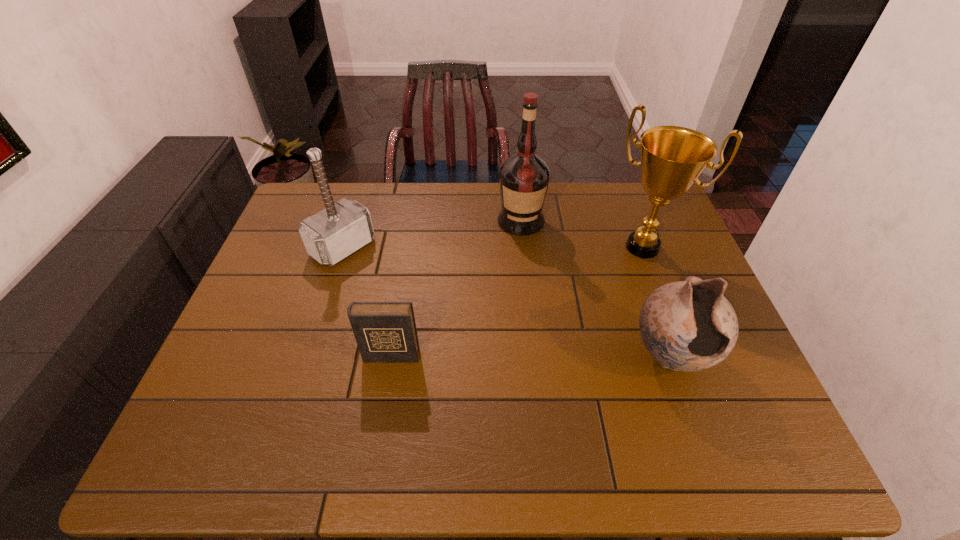
Locate an element on the screen. This screenshot has width=960, height=540. pottery that is at the right edge is located at coordinates (689, 325).

Identify the location of award that is at the right edge. The image size is (960, 540). (672, 158).

You are a GUI agent. You are given a task and a screenshot of the screen. Output one action in this format:
    pyautogui.click(x=<x>, y=<y>)
    Task: Click on the object present at the near right corner
    
    Given the screenshot: What is the action you would take?
    pyautogui.click(x=689, y=325)

Find the location of a particular element. free space at the far edge of the desktop is located at coordinates (587, 210).

Identify the location of vacant area at the near edge of the desktop. This screenshot has height=540, width=960. (390, 386).

This screenshot has width=960, height=540. Identify the location of vacant space at the left edge of the desktop. (295, 292).

You are a GUI agent. You are given a task and a screenshot of the screen. Output one action in this format:
    pyautogui.click(x=<x>, y=<y>)
    Task: Click on the vacant space at the right edge
    
    Given the screenshot: What is the action you would take?
    coord(712,369)

Find the location of a particular element. Image resolution: width=960 pixels, height=540 pixels. free spot at the near right corner of the desktop is located at coordinates (697, 390).

Image resolution: width=960 pixels, height=540 pixels. I want to click on unoccupied position between the liquor and the second shortest object, so click(595, 288).

Where is `unoccupied position between the diary and the leftmost object`? This screenshot has width=960, height=540. unoccupied position between the diary and the leftmost object is located at coordinates (367, 301).